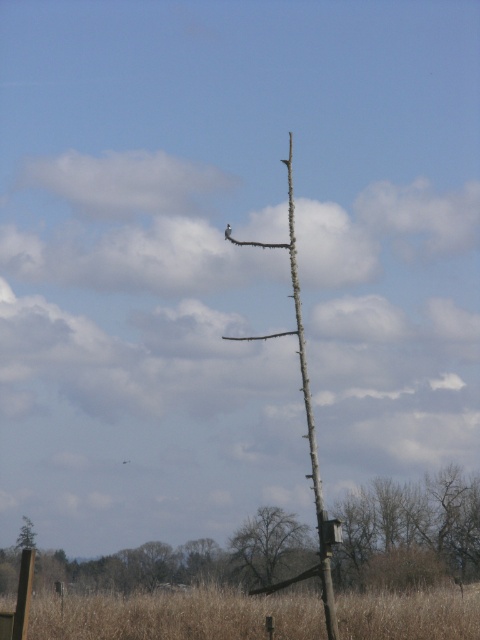
Does bare wood pole at lower center lie behind brown rough wood telegraph pole at center?

That is False.

Which is behind, point (467, 516) or point (328, 620)?

The point (467, 516) is more distant.

Who is more forward, (427, 532) or (290, 212)?

Point (290, 212) is more forward.

What are the coordinates of `bare wood pole at lower center` in the screenshot? It's located at (408, 532).

Looking at this image, is brown rough wood telegraph pole at center thinner than dark brown bark tree at center?

Incorrect, brown rough wood telegraph pole at center's width is not less than dark brown bark tree at center's.

Who is more forward, (249, 592) or (231, 566)?

Point (249, 592) is more forward.

Is point (330, 600) farther from camera compared to point (276, 554)?

No, (330, 600) is in front of (276, 554).

At what (x,y) coordinates should I click in order to perform the action: click on brown rough wood telegraph pole at center. Please return your answer as a coordinate pair (x, y). This screenshot has width=480, height=640. Looking at the image, I should click on (308, 429).

The image size is (480, 640). What are the coordinates of `bare wood pole at lower center` in the screenshot? It's located at (408, 532).

Between point (170, 550) and point (250, 532), which one is positioned in front?

Point (250, 532) is in front.

Does point (358, 529) come in front of point (310, 541)?

Yes, point (358, 529) is closer to viewer.

This screenshot has width=480, height=640. In order to click on bare wood pole at lower center in this screenshot , I will do `click(408, 532)`.